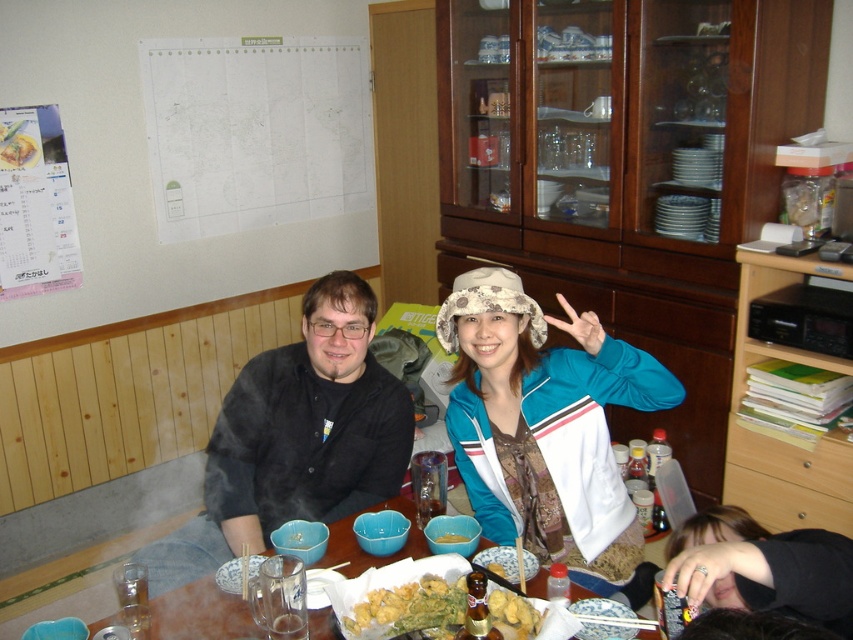
How distant is black matte jacket at center from wooden table at center?

black matte jacket at center and wooden table at center are 13.26 inches apart from each other.

Can you confirm if black matte jacket at center is positioned to the right of wooden table at center?

In fact, black matte jacket at center is to the left of wooden table at center.

You are a GUI agent. You are given a task and a screenshot of the screen. Output one action in this format:
    pyautogui.click(x=<x>, y=<y>)
    Task: Click on the black matte jacket at center
    The height and width of the screenshot is (640, 853).
    Given the screenshot: What is the action you would take?
    pyautogui.click(x=294, y=438)

At what (x,y) coordinates should I click in order to perform the action: click on black matte jacket at center. Please return your answer as a coordinate pair (x, y). The height and width of the screenshot is (640, 853). Looking at the image, I should click on (294, 438).

Can you confirm if wooden table at center is thinner than yellow matte rice bowl at center?

Incorrect, wooden table at center's width is not less than yellow matte rice bowl at center's.

Is wooden table at center bigger than yellow matte rice bowl at center?

Yes, wooden table at center is bigger than yellow matte rice bowl at center.

Identify the location of wooden table at center. (200, 612).

Locate an element on the screen. This screenshot has width=853, height=640. wooden table at center is located at coordinates (200, 612).

This screenshot has height=640, width=853. In order to click on white paper map at upper center in this screenshot , I will do `click(254, 131)`.

Is white paper map at upper center smaller than wooden table at center?

No.

Between point (200, 97) and point (326, 557), which one is positioned behind?

Positioned behind is point (200, 97).

Locate an element on the screen. white paper map at upper center is located at coordinates [254, 131].